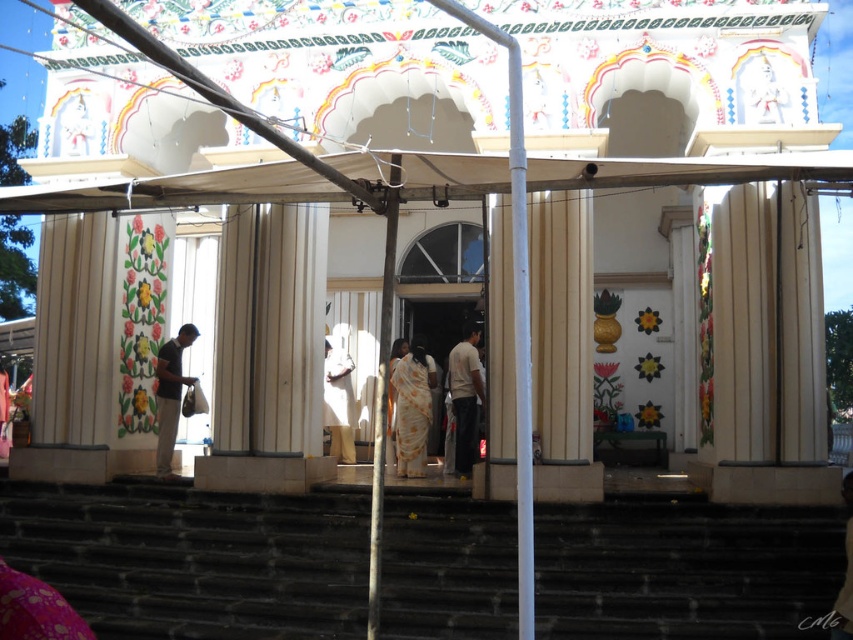
You are standing at the entrance of the temple and see the dark stone stairs at lower center and the white cotton shirt at center. Which object is bigger in size?

The dark stone stairs at lower center is larger in size than the white cotton shirt at center.

You are standing at the entrance of the temple and want to place two decorative lights. One light needs to be placed at point (291, 593) and the other at point (421, 330). Which point is closer to you?

Point (291, 593) is closer to the viewer than point (421, 330).

You are standing at the entrance of the temple and see the dark stone stairs at lower center and the white cotton shirt at center. Which object is located to the left of the other?

The dark stone stairs at lower center is positioned on the left side of white cotton shirt at center.